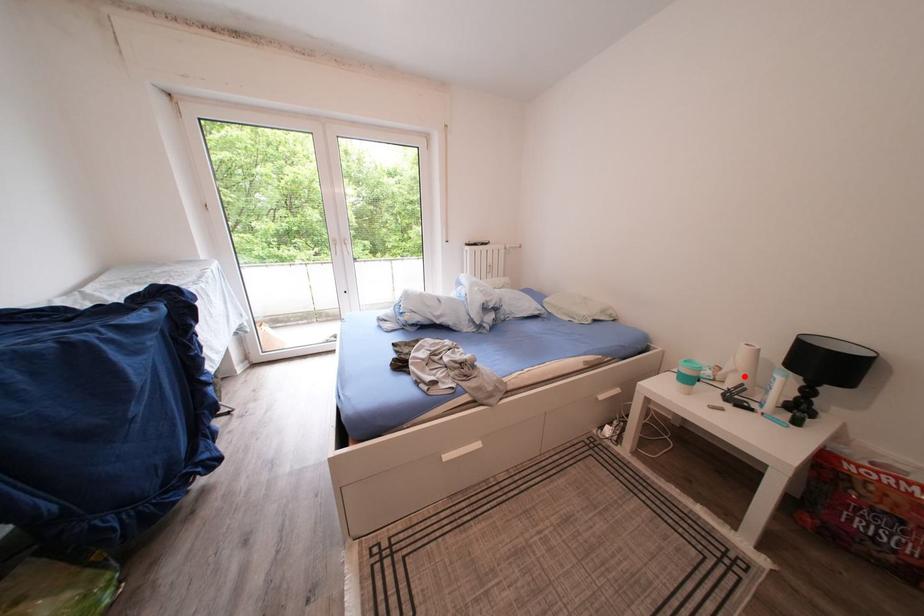
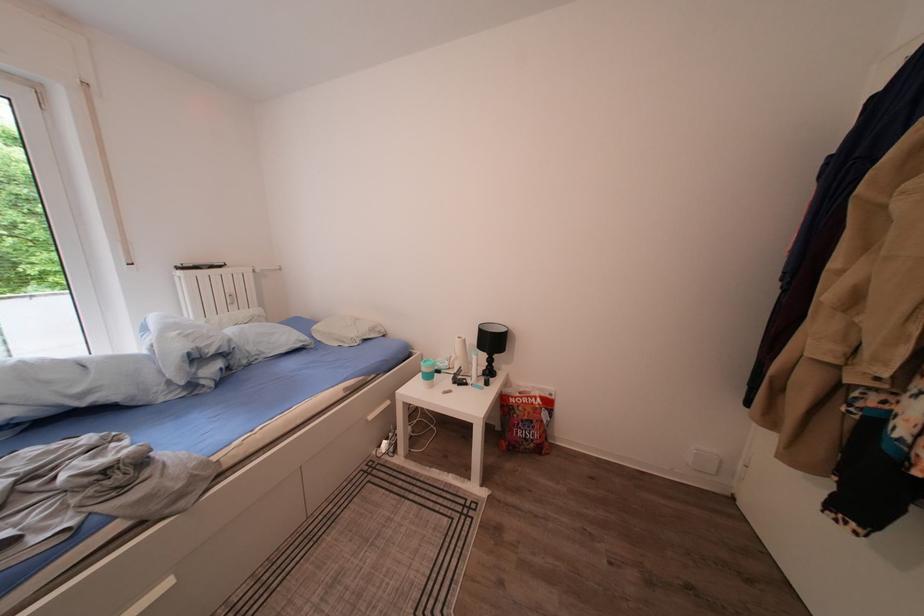
Question: I am providing you with two images of the same scene from different viewpoints. A red point is shown in image1. For the corresponding object point in image2, is it positioned nearer or farther from the camera?

Choices:
 (A) Nearer
 (B) Farther

Answer: (B)